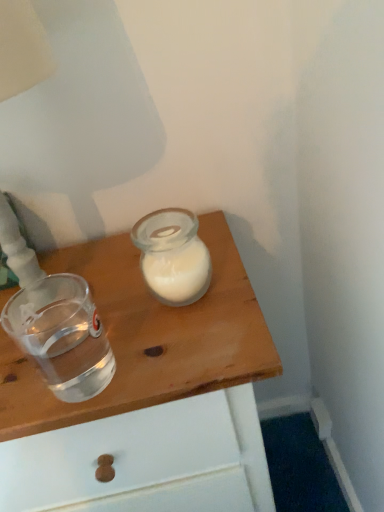
Where is `transparent glass at upper center`? The image size is (384, 512). transparent glass at upper center is located at coordinates (145, 392).

The width and height of the screenshot is (384, 512). Describe the element at coordinates (145, 392) in the screenshot. I see `transparent glass at upper center` at that location.

What do you see at coordinates (62, 336) in the screenshot?
I see `transparent plastic shot glass at left` at bounding box center [62, 336].

What is the approximate width of transparent plastic shot glass at left?

It is 3.37 inches.

At what (x,y) coordinates should I click in order to perform the action: click on transparent plastic shot glass at left. Please return your answer as a coordinate pair (x, y). The width and height of the screenshot is (384, 512). Looking at the image, I should click on (62, 336).

At what (x,y) coordinates should I click in order to perform the action: click on transparent glass at upper center. Please return your answer as a coordinate pair (x, y). Image resolution: width=384 pixels, height=512 pixels. Looking at the image, I should click on (145, 392).

From the picture: Is transparent plastic shot glass at left at the left side of transparent glass at upper center?

Yes, transparent plastic shot glass at left is to the left of transparent glass at upper center.

Is the depth of transparent plastic shot glass at left less than that of transparent glass at upper center?

Yes, transparent plastic shot glass at left is in front of transparent glass at upper center.

Is point (53, 373) farther from camera compared to point (165, 429)?

That is True.

From the image's perspective, which one is positioned lower, transparent plastic shot glass at left or transparent glass at upper center?

transparent glass at upper center.

From a real-world perspective, which is physically above, transparent plastic shot glass at left or transparent glass at upper center?

transparent plastic shot glass at left is physically above.

Considering the relative sizes of transparent plastic shot glass at left and transparent glass at upper center in the image provided, is transparent plastic shot glass at left wider than transparent glass at upper center?

No, transparent plastic shot glass at left is not wider than transparent glass at upper center.

Between transparent plastic shot glass at left and transparent glass at upper center, which one has more height?

transparent glass at upper center.

Which of these two, transparent plastic shot glass at left or transparent glass at upper center, is bigger?

With larger size is transparent glass at upper center.

Would you say transparent plastic shot glass at left is inside or outside transparent glass at upper center?

transparent plastic shot glass at left lies outside transparent glass at upper center.

Is transparent plastic shot glass at left in contact with transparent glass at upper center?

transparent plastic shot glass at left and transparent glass at upper center are not in contact.

Is transparent plastic shot glass at left oriented away from transparent glass at upper center?

No.

Measure the distance between transparent plastic shot glass at left and transparent glass at upper center.

transparent plastic shot glass at left is 4.84 inches from transparent glass at upper center.

Where is `table beneath the transparent plastic shot glass at left (from a real-world perspective)`? The height and width of the screenshot is (512, 384). table beneath the transparent plastic shot glass at left (from a real-world perspective) is located at coordinates (145, 392).

Between transparent glass at upper center and transparent plastic shot glass at left, which one appears on the left side from the viewer's perspective?

From the viewer's perspective, transparent plastic shot glass at left appears more on the left side.

Between transparent glass at upper center and transparent plastic shot glass at left, which one is positioned in front?

transparent plastic shot glass at left is closer to the camera.

Is point (0, 463) farther from camera compared to point (32, 300)?

Yes, it is.

From the image's perspective, is transparent glass at upper center on transparent plastic shot glass at left?

Incorrect, from the image's perspective, transparent glass at upper center is lower than transparent plastic shot glass at left.

From a real-world perspective, is transparent glass at upper center over transparent plastic shot glass at left?

Actually, transparent glass at upper center is physically below transparent plastic shot glass at left in the real world.

Is transparent glass at upper center thinner than transparent plastic shot glass at left?

No.

Considering the sizes of transparent glass at upper center and transparent plastic shot glass at left in the image, is transparent glass at upper center taller or shorter than transparent plastic shot glass at left?

In the image, transparent glass at upper center appears to be taller than transparent plastic shot glass at left.

Does transparent glass at upper center have a smaller size compared to transparent plastic shot glass at left?

Incorrect, transparent glass at upper center is not smaller in size than transparent plastic shot glass at left.

Is transparent glass at upper center surrounding transparent plastic shot glass at left?

Definitely not — transparent plastic shot glass at left is not inside transparent glass at upper center.

Is transparent glass at upper center next to transparent plastic shot glass at left?

No, transparent glass at upper center is not next to transparent plastic shot glass at left.

Is transparent glass at upper center positioned with its back to transparent plastic shot glass at left?

No.

How different are the orientations of transparent glass at upper center and transparent plastic shot glass at left in degrees?

The facing directions of transparent glass at upper center and transparent plastic shot glass at left are 1.93 degrees apart.

This screenshot has width=384, height=512. In order to click on table behind the transparent plastic shot glass at left in this screenshot , I will do 145,392.

Where is `table below the transparent plastic shot glass at left (from a real-world perspective)`? table below the transparent plastic shot glass at left (from a real-world perspective) is located at coordinates (145, 392).

Locate an element on the screen. This screenshot has width=384, height=512. shot glass in front of the transparent glass at upper center is located at coordinates (62, 336).